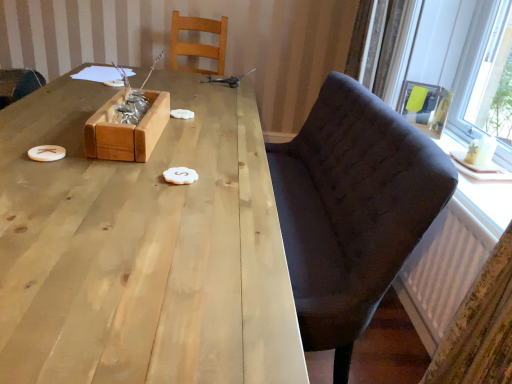
Question: From a real-world perspective, is natural wood table at center physically located above or below matte black armchair at upper right?

Choices:
 (A) below
 (B) above

Answer: (A)

Question: Is natural wood table at center inside the boundaries of matte black armchair at upper right, or outside?

Choices:
 (A) inside
 (B) outside

Answer: (B)

Question: Estimate the real-world distances between objects in this image. Which object is farther from the wooden chair at upper center, the 2th chair viewed from the left?

Choices:
 (A) white matte cookie at center, the first food in the left-to-right sequence
 (B) white matte cookie at center, which is counted as the 2th food, starting from the back
 (C) wooden box at center
 (D) transparent glass window at upper right
 (E) dark fabric chair at right, which ranks as the 1th chair in right-to-left order

Answer: (B)

Question: Estimate the real-world distances between objects in this image. Which object is closer to the white matte cookie at center, the first food in the right-to-left sequence?

Choices:
 (A) transparent glass window at upper right
 (B) white matte cookie at center, acting as the 2th food starting from the front
 (C) wooden chair at upper center, which is counted as the 2th chair, starting from the right
 (D) matte black armchair at upper right
 (E) natural wood table at center

Answer: (E)